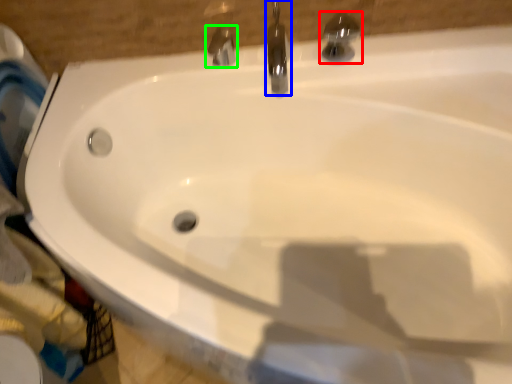
Question: Based on their relative distances, which object is farther from tap (highlighted by a red box)? Choose from tap (highlighted by a blue box) and tap (highlighted by a green box).

Choices:
 (A) tap
 (B) tap

Answer: (B)